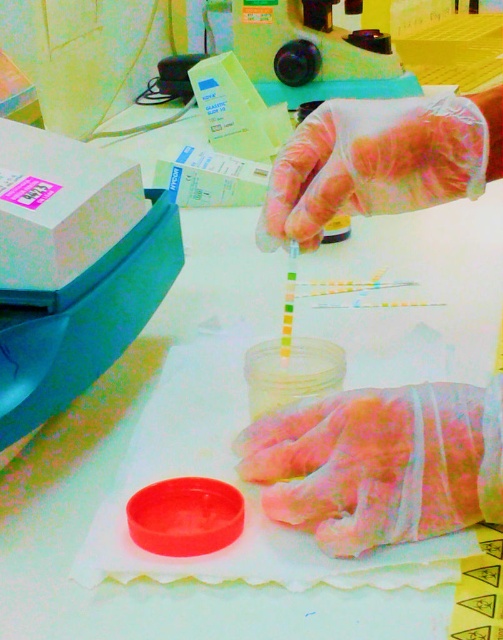
Looking at this image, between matte plastic box at left and clear plastic glove at upper center, which one appears on the left side from the viewer's perspective?

From the viewer's perspective, matte plastic box at left appears more on the left side.

Is point (88, 202) positioned in front of point (360, 147)?

No, (88, 202) is behind (360, 147).

Where is `matte plastic box at left`? This screenshot has width=503, height=640. matte plastic box at left is located at coordinates click(x=67, y=266).

Is point (89, 260) in front of point (396, 486)?

No.

Who is shorter, matte plastic box at left or pink latex glove at center?

Standing shorter between the two is pink latex glove at center.

The image size is (503, 640). What do you see at coordinates (67, 266) in the screenshot?
I see `matte plastic box at left` at bounding box center [67, 266].

The width and height of the screenshot is (503, 640). What are the coordinates of `matte plastic box at left` in the screenshot? It's located at (67, 266).

Measure the distance between pink latex glove at center and clear plastic glove at upper center.

The distance of pink latex glove at center from clear plastic glove at upper center is 19.31 centimeters.

Between pink latex glove at center and clear plastic glove at upper center, which one appears on the left side from the viewer's perspective?

pink latex glove at center is more to the left.

Where is `pink latex glove at center`? Image resolution: width=503 pixels, height=640 pixels. pink latex glove at center is located at coordinates (381, 464).

Find the location of a particular element. This screenshot has height=640, width=503. pink latex glove at center is located at coordinates [x=381, y=464].